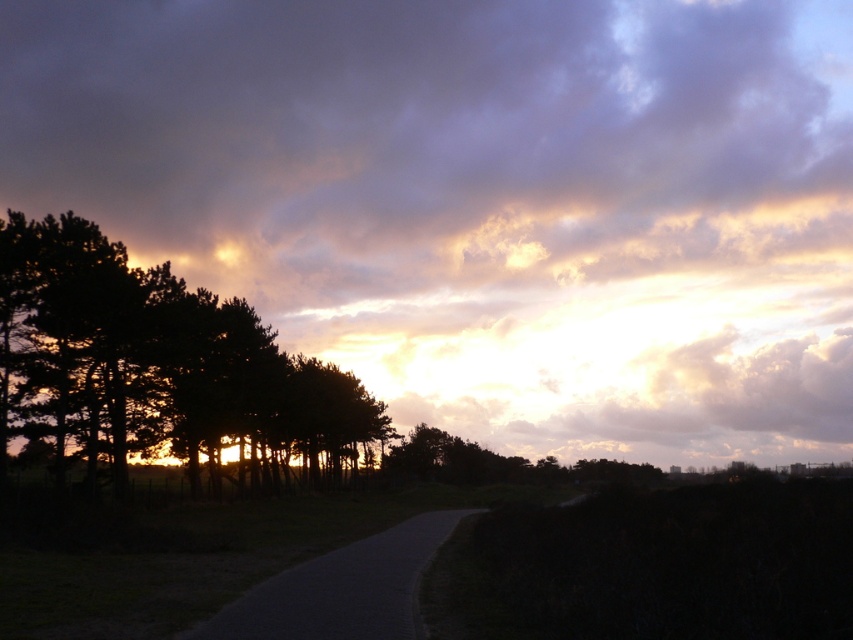
You are standing at the point closer to the camera in the scene. Which point are you at, point (558, 259) or point (288, 420)?

You are at point (558, 259) because it is further to the camera than point (288, 420).

You are standing on the curved paved path and want to take a photo of the cloudy sky at upper center and dark green foliage at left. Which object should you point your camera towards first to capture both in the frame?

You should point your camera towards the cloudy sky at upper center first since it is positioned over the dark green foliage at left, meaning it is higher up in the frame and would need to be framed from the top downward to include both objects.